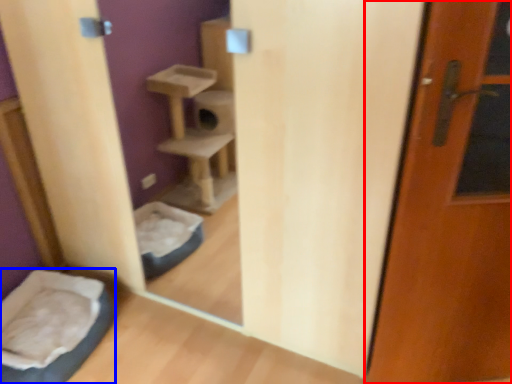
Question: Which of the following is the closest to the observer, door (highlighted by a red box) or wide (highlighted by a blue box)?

Choices:
 (A) door
 (B) wide

Answer: (A)